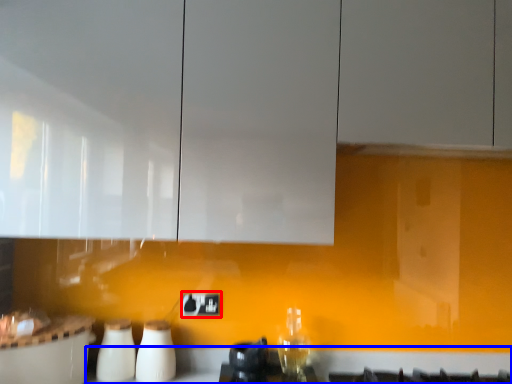
Question: Which object appears farthest to the camera in this image, electric outlet (highlighted by a red box) or counter top (highlighted by a blue box)?

Choices:
 (A) electric outlet
 (B) counter top

Answer: (A)